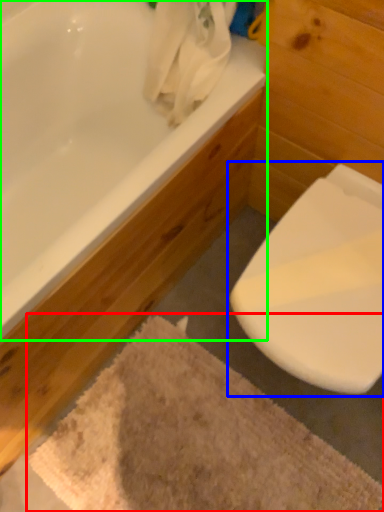
Question: Which object is the farthest from bath mat (highlighted by a red box)? Choose among these: toilet (highlighted by a blue box) or bathtub (highlighted by a green box).

Choices:
 (A) toilet
 (B) bathtub

Answer: (B)